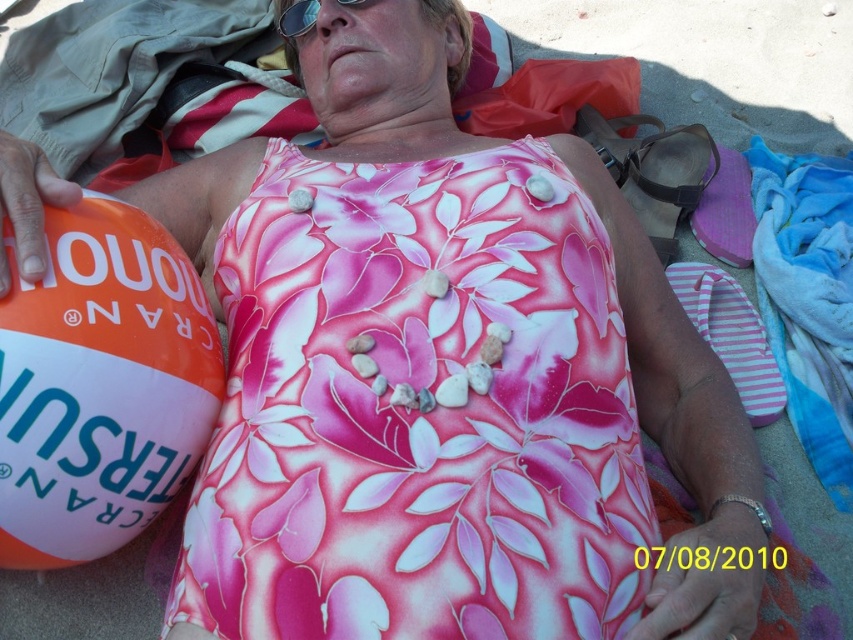
What object is located at the point with coordinates (100,385)?

The orange and white beach ball at left is located at point (100,385).

You are standing at point (283,24) and want to walk to point (85,291). Which direction should you walk to reach your destination?

You should walk forward because point (85,291) is in front of point (283,24).